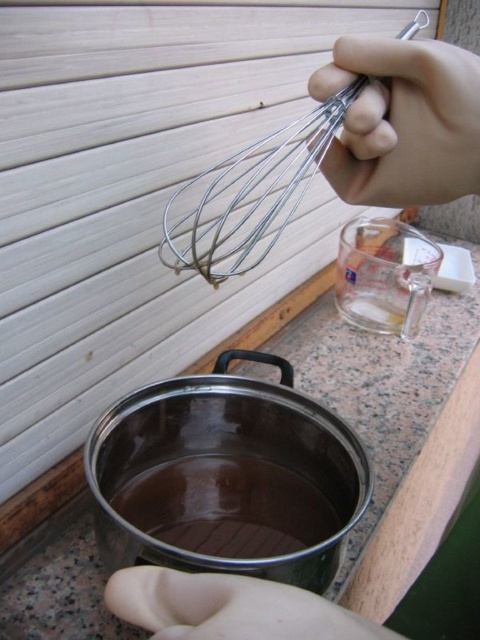
You are a chef trying to pour the transparent glass liquid at center into a container. Can you safely hold the skinny white hand at center while pouring?

The transparent glass liquid at center is wider than the skinny white hand at center, so holding the hand while pouring may be difficult due to the liquid being wider.

You are a chef trying to mix ingredients in the transparent glass liquid at center. The metallic wire whisk at upper center is currently above it. Can you use the whisk to stir the liquid without touching the sides of the glass?

The metallic wire whisk at upper center is above the transparent glass liquid at center, so yes, you can stir the liquid without touching the sides of the glass by lowering the whisk into the center.

What object is located at the coordinates point (403, 122)?

The metallic whisk at upper center is located at point (403, 122).